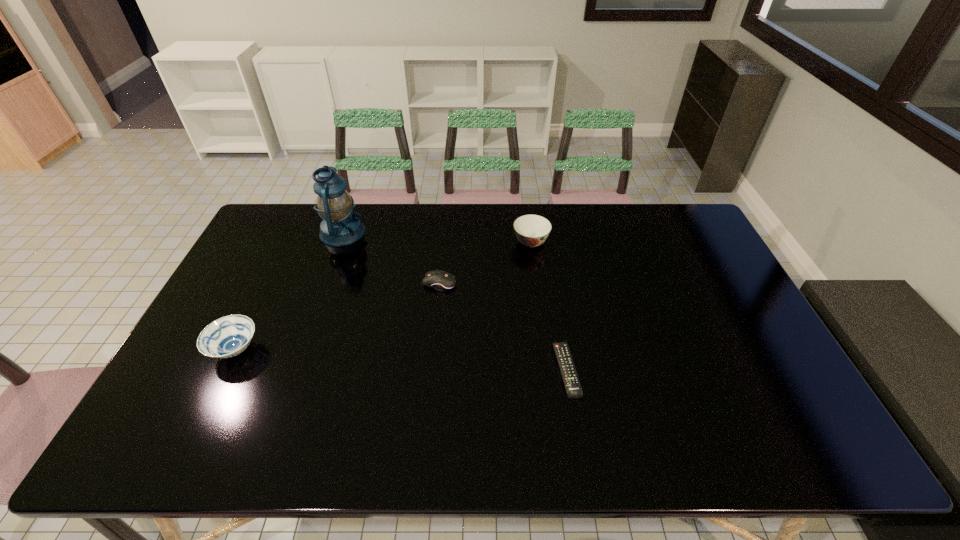
Where is `free region located on the front of the leftmost object`? The height and width of the screenshot is (540, 960). free region located on the front of the leftmost object is located at coordinates (188, 446).

Locate an element on the screen. Image resolution: width=960 pixels, height=540 pixels. free space located 0.210m on the back of the second shortest object is located at coordinates (444, 234).

The width and height of the screenshot is (960, 540). Find the location of `vacant space located on the back of the shortest object`. vacant space located on the back of the shortest object is located at coordinates (548, 261).

In order to click on lantern that is at the far edge in this screenshot , I will do `click(340, 227)`.

The width and height of the screenshot is (960, 540). Find the location of `soup bowl present at the far edge`. soup bowl present at the far edge is located at coordinates (532, 230).

Find the location of a particular element. The image size is (960, 540). object positioned at the left edge is located at coordinates (228, 336).

Find the location of a particular element. The height and width of the screenshot is (540, 960). vacant point at the far edge is located at coordinates (609, 205).

Locate an element on the screen. The width and height of the screenshot is (960, 540). vacant space at the near edge of the desktop is located at coordinates (360, 434).

In the image, there is a desktop. Where is `free space at the left edge`? free space at the left edge is located at coordinates (263, 247).

Identify the location of vacant space at the right edge of the desktop. (725, 382).